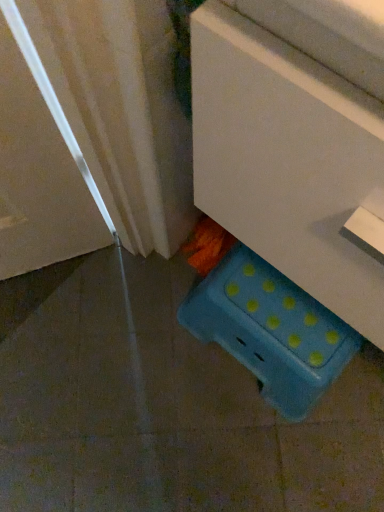
Question: Does blue plastic stool at lower center turn towards blue polka dot plastic storage box at lower right?

Choices:
 (A) no
 (B) yes

Answer: (A)

Question: Can you confirm if blue plastic stool at lower center is smaller than blue polka dot plastic storage box at lower right?

Choices:
 (A) yes
 (B) no

Answer: (B)

Question: From the image's perspective, is blue plastic stool at lower center above blue polka dot plastic storage box at lower right?

Choices:
 (A) no
 (B) yes

Answer: (B)

Question: Is blue plastic stool at lower center closer to camera compared to blue polka dot plastic storage box at lower right?

Choices:
 (A) no
 (B) yes

Answer: (B)

Question: Can you confirm if blue plastic stool at lower center is positioned to the left of blue polka dot plastic storage box at lower right?

Choices:
 (A) yes
 (B) no

Answer: (B)

Question: Is blue plastic stool at lower center looking in the opposite direction of blue polka dot plastic storage box at lower right?

Choices:
 (A) no
 (B) yes

Answer: (A)

Question: Is blue polka dot plastic storage box at lower right taller than blue plastic stool at lower center?

Choices:
 (A) yes
 (B) no

Answer: (B)

Question: Is blue polka dot plastic storage box at lower right not close to blue plastic stool at lower center?

Choices:
 (A) yes
 (B) no

Answer: (B)

Question: Does blue polka dot plastic storage box at lower right lie in front of blue plastic stool at lower center?

Choices:
 (A) yes
 (B) no

Answer: (B)

Question: From the image's perspective, is blue polka dot plastic storage box at lower right above blue plastic stool at lower center?

Choices:
 (A) yes
 (B) no

Answer: (B)

Question: Considering the relative sizes of blue polka dot plastic storage box at lower right and blue plastic stool at lower center in the image provided, is blue polka dot plastic storage box at lower right smaller than blue plastic stool at lower center?

Choices:
 (A) no
 (B) yes

Answer: (B)

Question: From the image's perspective, would you say blue polka dot plastic storage box at lower right is shown under blue plastic stool at lower center?

Choices:
 (A) yes
 (B) no

Answer: (A)

Question: From the image's perspective, relative to blue plastic stool at lower center, is blue polka dot plastic storage box at lower right above or below?

Choices:
 (A) below
 (B) above

Answer: (A)